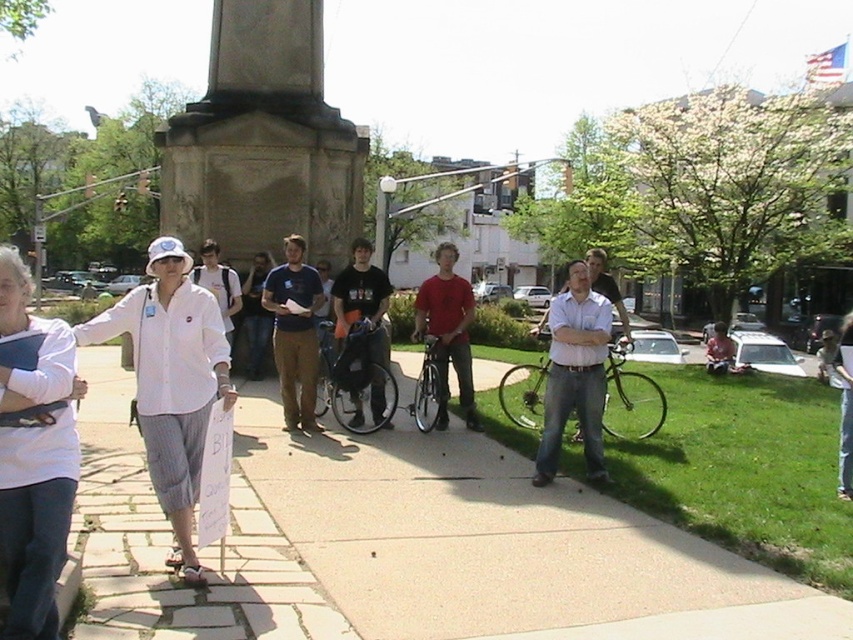
Is white cotton shirt at center smaller than white matte shirt at center?

No.

Between white cotton shirt at center and white matte shirt at center, which one has more height?

white cotton shirt at center

Who is more forward, (175,561) or (204,241)?

Point (175,561) is more forward.

Where is `white cotton shirt at center`? The width and height of the screenshot is (853, 640). white cotton shirt at center is located at coordinates click(x=171, y=381).

Which is more to the left, light blue shirt at center or dark blue t-shirt at center?

Positioned to the left is dark blue t-shirt at center.

Between point (558, 390) and point (287, 396), which one is positioned in front?

Point (558, 390) is more forward.

I want to click on light blue shirt at center, so click(573, 372).

Is matte black wheelchair at center smaller than white matte shirt at center?

Correct, matte black wheelchair at center occupies less space than white matte shirt at center.

Is matte black wheelchair at center shorter than white matte shirt at center?

No, matte black wheelchair at center is not shorter than white matte shirt at center.

Does point (390, 289) lie in front of point (225, 339)?

No, it is behind (225, 339).

You are a GUI agent. You are given a task and a screenshot of the screen. Output one action in this format:
    pyautogui.click(x=<x>, y=<y>)
    Task: Click on the matte black wheelchair at center
    This screenshot has width=853, height=640.
    Given the screenshot: What is the action you would take?
    pyautogui.click(x=358, y=289)